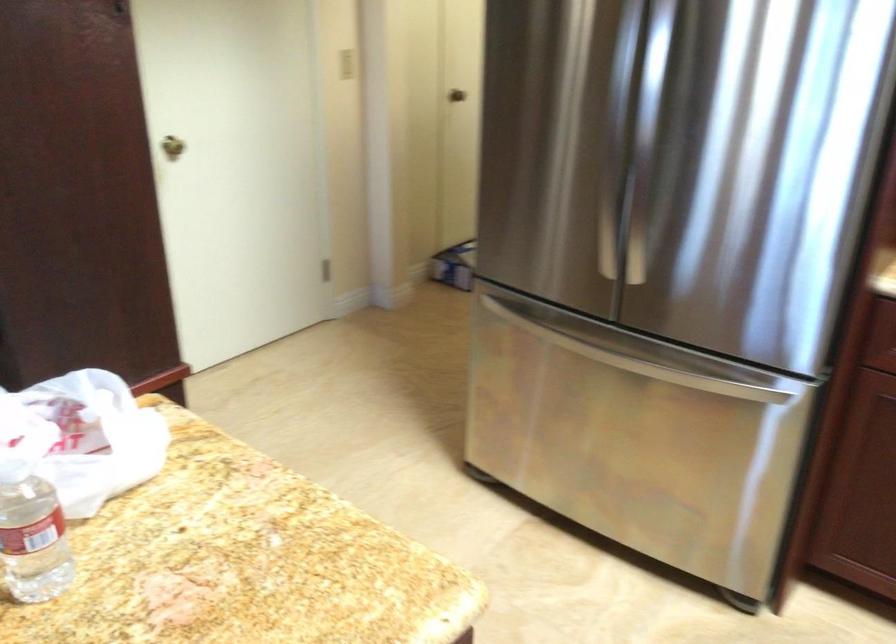
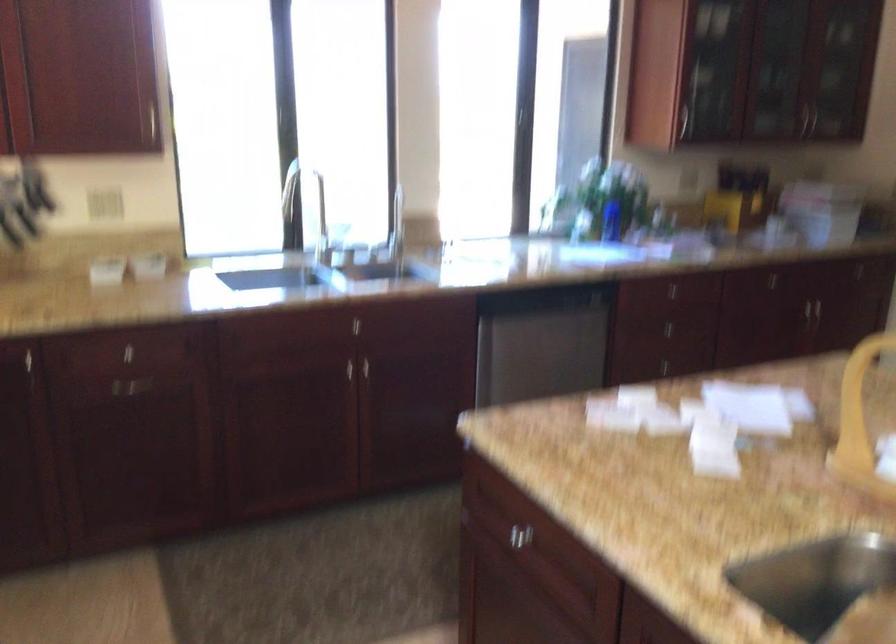
How did the camera likely rotate?

The rotation direction of the camera is left-down.